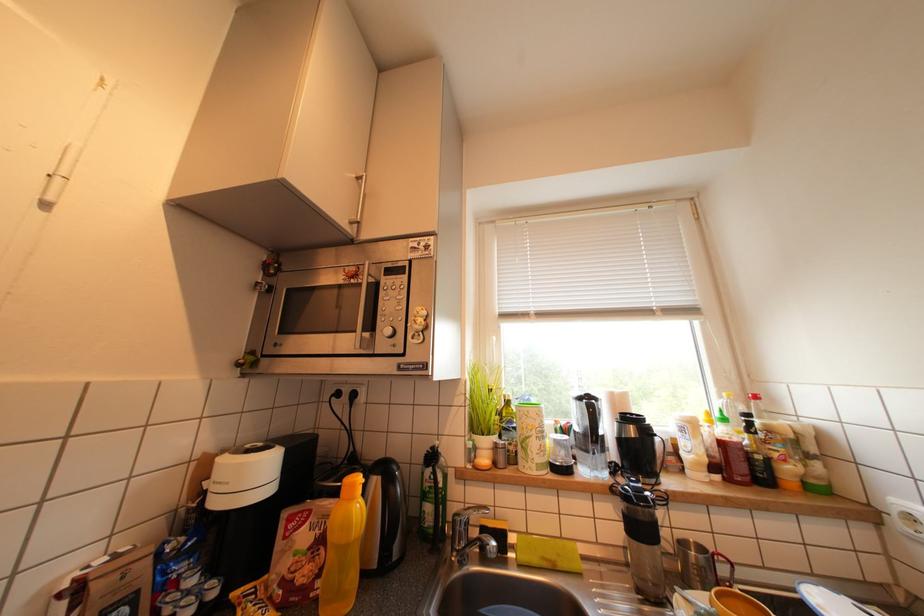
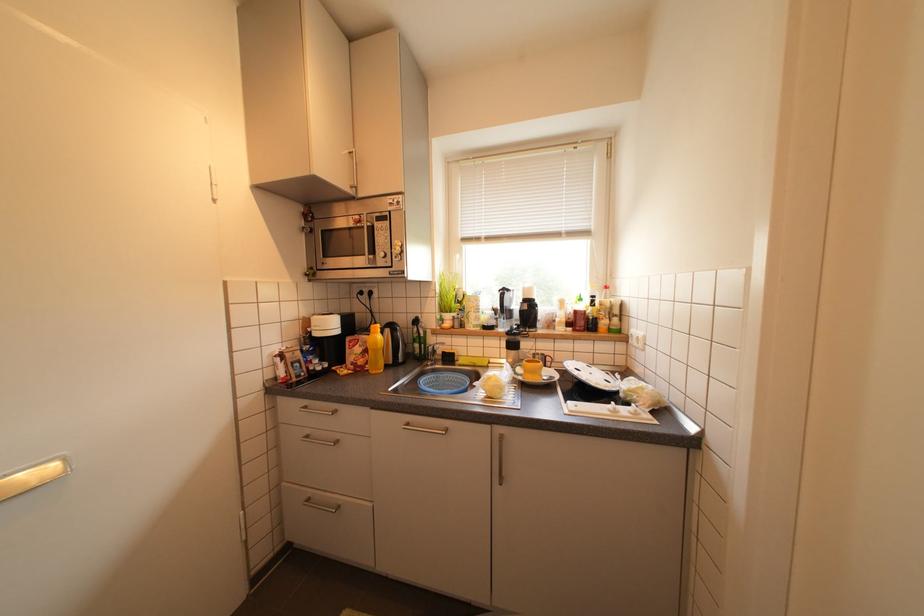
In a continuous first-person perspective shot, in which direction is the camera moving?

The movement direction of the cameraman is right, backward.